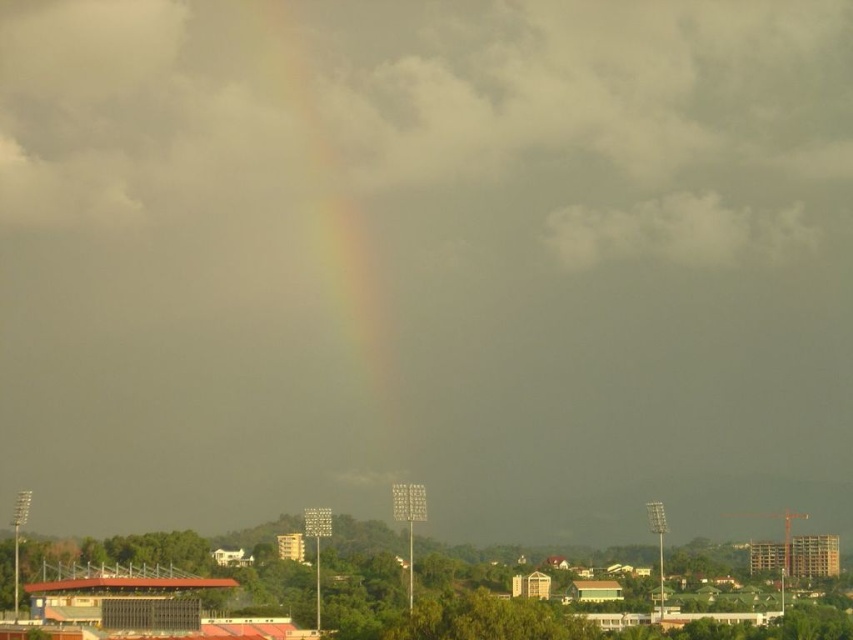
You are an artist planning to paint the scene. You want to ensure the rainbow at center is visually balanced with the gray cotton cloud at upper center. Given their sizes, which object should you adjust to make them more similar in visual weight?

The rainbow at center is thinner than the gray cotton cloud at upper center. To balance their visual weight, you should widen the rainbow at center or narrow the gray cotton cloud at upper center.